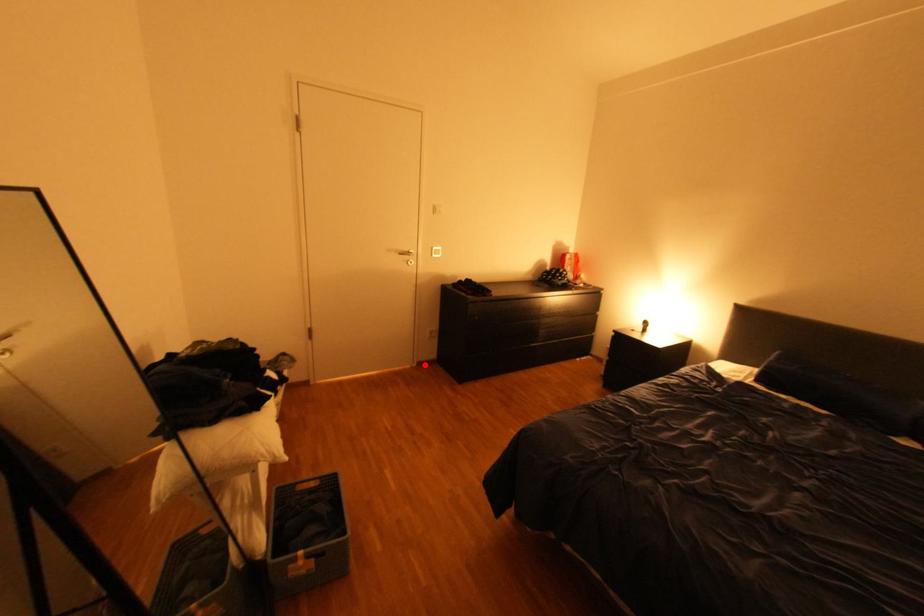
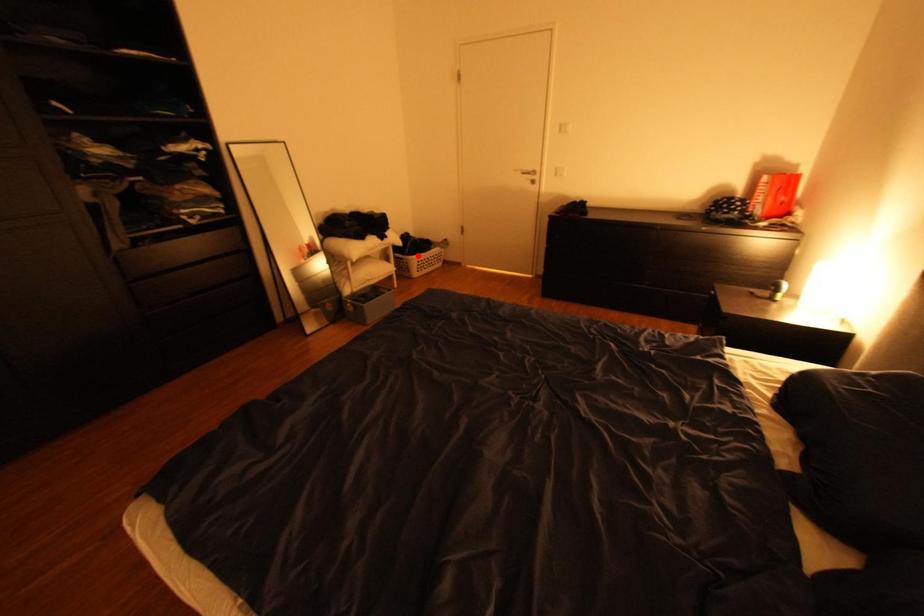
I am providing you with two images of the same scene from different viewpoints. A red point is marked on the first image and another point is marked on the second image. Is the red point in image1 aligned with the point shown in image2?

No